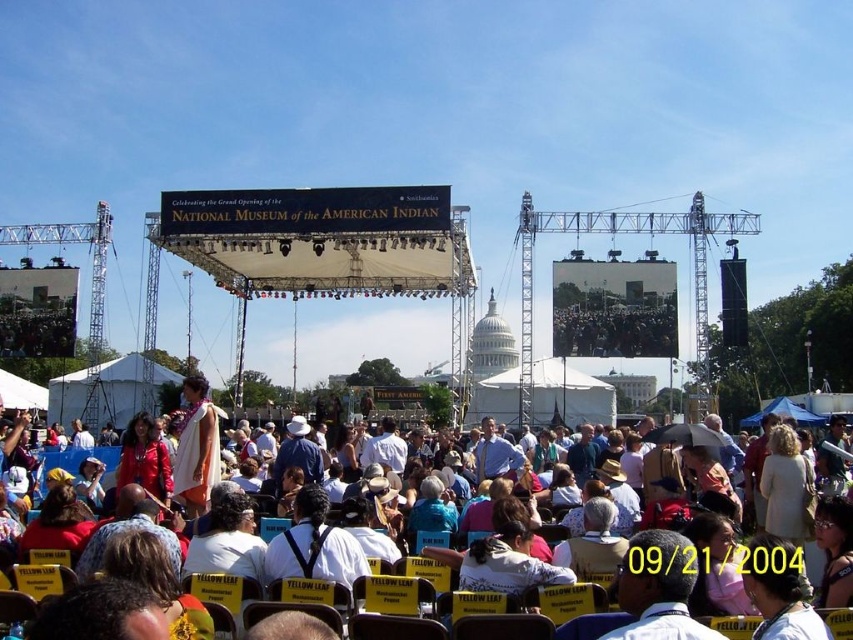
You are a photographer at the event and need to capture a clear photo of both the white shirt at center and the white cotton shirt at center. Which shirt should you focus on first to ensure it appears larger in the photo?

The white shirt at center is taller than the white cotton shirt at center, so you should focus on the white shirt at center first to ensure it appears larger in the photo.

You are attending the event and want to locate the person wearing the white shirt at center. Where would you look relative to the black fabric backpack at center?

The white shirt at center is to the right of the black fabric backpack at center, so you should look to the right side of the backpack to find the person wearing the white shirt at center.